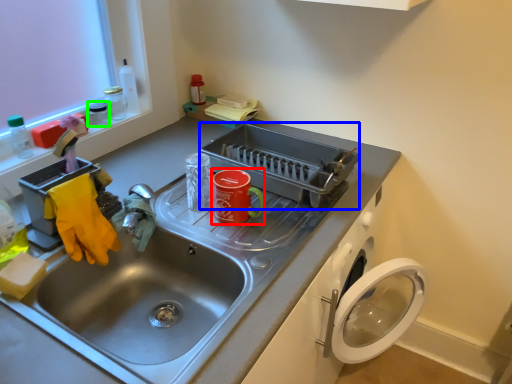
Question: Based on their relative distances, which object is nearer to appliance (highlighted by a red box)? Choose from appliance (highlighted by a blue box) and appliance (highlighted by a green box).

Choices:
 (A) appliance
 (B) appliance

Answer: (A)